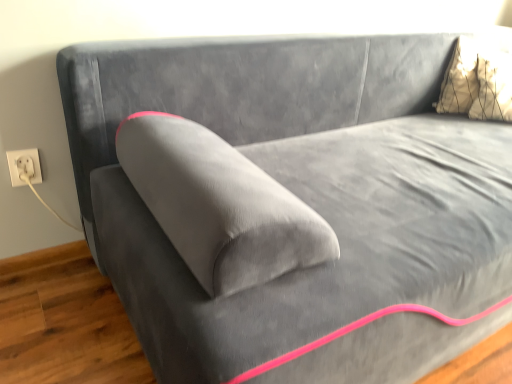
Measure the distance between point (449, 84) and camera.

Point (449, 84) is 1.74 meters from camera.

Where is `white plastic socket at lower left`? Image resolution: width=512 pixels, height=384 pixels. white plastic socket at lower left is located at coordinates (24, 167).

Locate an element on the screen. The height and width of the screenshot is (384, 512). white cord at lower left is located at coordinates (40, 196).

Is metallic gold pillow at upper right thinner than white plastic socket at lower left?

Incorrect, the width of metallic gold pillow at upper right is not less than that of white plastic socket at lower left.

From the image's perspective, is metallic gold pillow at upper right under white plastic socket at lower left?

No, from the image's perspective, metallic gold pillow at upper right is not below white plastic socket at lower left.

Is metallic gold pillow at upper right placed right next to white plastic socket at lower left?

No, metallic gold pillow at upper right is not in contact with white plastic socket at lower left.

Which is behind, point (479, 40) or point (38, 182)?

The point (479, 40) is farther from the camera.

What's the angular difference between white plastic socket at lower left and white cord at lower left's facing directions?

The angle between the facing direction of white plastic socket at lower left and the facing direction of white cord at lower left is 0.000587 degrees.

From the image's perspective, is white plastic socket at lower left beneath white cord at lower left?

No, from the image's perspective, white plastic socket at lower left is not beneath white cord at lower left.

From a real-world perspective, which object stands above the other?

From a 3D spatial view, white plastic socket at lower left is above.

In the scene shown: Does white plastic socket at lower left appear on the left side of white cord at lower left?

Yes.

Could you tell me if white cord at lower left is turned towards metallic gold pillow at upper right?

No, white cord at lower left is not oriented towards metallic gold pillow at upper right.

From a real-world perspective, is white cord at lower left positioned under metallic gold pillow at upper right based on gravity?

Correct, in the physical world, white cord at lower left is lower than metallic gold pillow at upper right.

Does point (30, 173) come closer to viewer compared to point (453, 80)?

That is True.

Who is smaller, white cord at lower left or metallic gold pillow at upper right?

Smaller between the two is white cord at lower left.

Could you tell me if metallic gold pillow at upper right is turned towards white cord at lower left?

No, metallic gold pillow at upper right is not turned towards white cord at lower left.

Between point (470, 95) and point (33, 188), which one is positioned behind?

The point (470, 95) is farther.

From the image's perspective, which is below, metallic gold pillow at upper right or white cord at lower left?

white cord at lower left is shown below in the image.

Choose the correct answer: Is metallic gold pillow at upper right inside white cord at lower left or outside it?

metallic gold pillow at upper right is located beyond the bounds of white cord at lower left.

There is a white cord at lower left. At what (x,y) coordinates should I click in order to perform the action: click on electric outlet above it (from a real-world perspective). Please return your answer as a coordinate pair (x, y). Looking at the image, I should click on (24, 167).

Who is smaller, white cord at lower left or white plastic socket at lower left?

white plastic socket at lower left is smaller.

The image size is (512, 384). Identify the location of electric outlet below the metallic gold pillow at upper right (from the image's perspective). (24, 167).

Considering the sizes of objects white plastic socket at lower left and metallic gold pillow at upper right in the image provided, who is taller, white plastic socket at lower left or metallic gold pillow at upper right?

With more height is metallic gold pillow at upper right.

Can you see white plastic socket at lower left touching metallic gold pillow at upper right?

They are not placed beside each other.

Which is behind, point (29, 171) or point (450, 110)?

The point (450, 110) is farther from the camera.

Locate an element on the screen. The image size is (512, 384). pillow above the white plastic socket at lower left (from a real-world perspective) is located at coordinates (x=477, y=81).

Find the location of `string directly beneath the white plastic socket at lower left (from a real-world perspective)`. string directly beneath the white plastic socket at lower left (from a real-world perspective) is located at coordinates (40, 196).

Estimate the real-world distances between objects in this image. Which object is further from metallic gold pillow at upper right, white cord at lower left or white plastic socket at lower left?

Based on the image, white plastic socket at lower left appears to be further to metallic gold pillow at upper right.

Considering their positions, is white plastic socket at lower left positioned further to metallic gold pillow at upper right than white cord at lower left?

white plastic socket at lower left.

From the image, which object appears to be farther from white cord at lower left, metallic gold pillow at upper right or white plastic socket at lower left?

metallic gold pillow at upper right.

Based on their spatial positions, is white plastic socket at lower left or metallic gold pillow at upper right further from white cord at lower left?

metallic gold pillow at upper right.

When comparing their distances from white plastic socket at lower left, does metallic gold pillow at upper right or white cord at lower left seem closer?

white cord at lower left is closer to white plastic socket at lower left.

Based on their spatial positions, is white cord at lower left or metallic gold pillow at upper right further from white plastic socket at lower left?

Among the two, metallic gold pillow at upper right is located further to white plastic socket at lower left.

Find the location of a particular element. string between white plastic socket at lower left and metallic gold pillow at upper right is located at coordinates (40, 196).